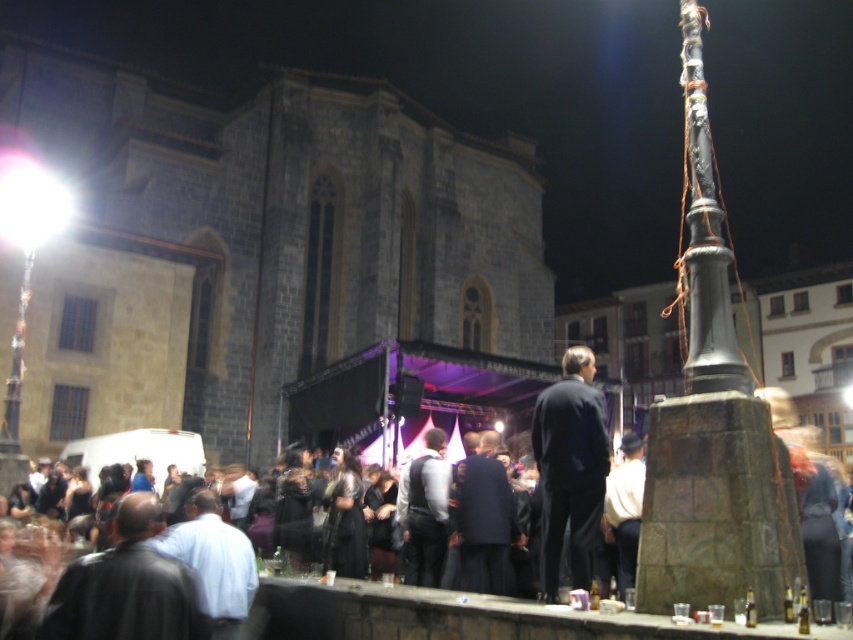
You are a photographer trying to capture the entire scene of the dark gray stone church at upper left and the polished metal pole at right in a single photo. Based on their positions, which object should you place closer to the left side of your camera frame?

The dark gray stone church at upper left should be placed closer to the left side of your camera frame since it is positioned on the left side of the polished metal pole at right.

You are a performer who needs to set up a 10 meter long stage extension between the dark gray stone church at upper left and the polished metal pole at right. Can you fit it without overlapping either structure?

The distance between the dark gray stone church at upper left and the polished metal pole at right is 37.00 meters, so a 10 meter long stage extension can easily fit without overlapping either structure since 10 meters is less than 37 meters.

You are standing at the center of the square and want to reach the polished metal pole at right. Which direction should you move to reach it?

You should move to your right to reach the polished metal pole at right since it is located at the right side of the square.